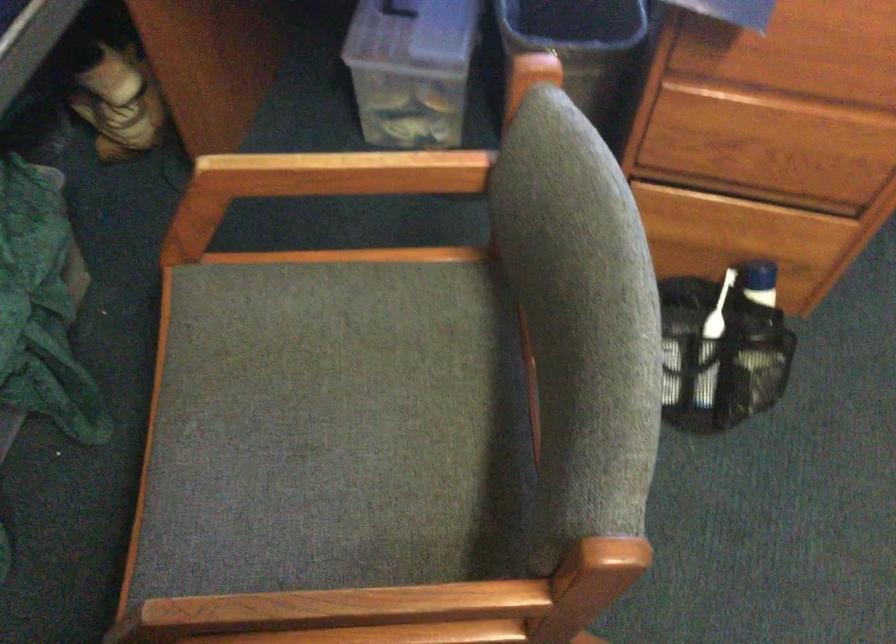
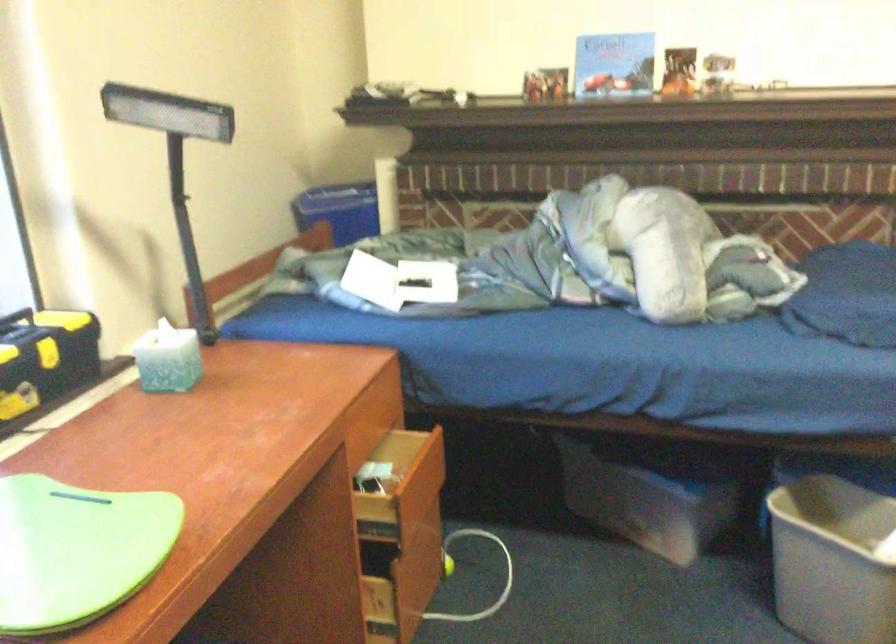
Question: The first image is from the beginning of the video and the second image is from the end. How did the camera likely rotate when shooting the video?

Choices:
 (A) Left
 (B) Right
 (C) Up
 (D) Down

Answer: (B)